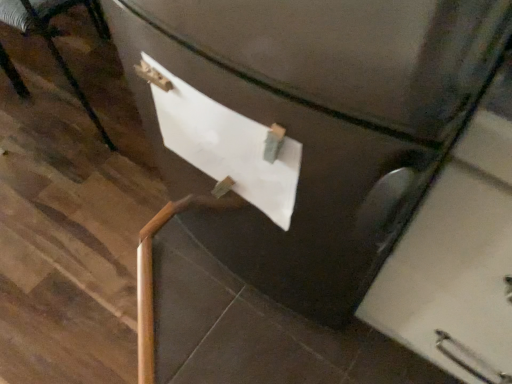
Question: Would you say white matte paper at center is inside or outside brushed metal chair at lower left?

Choices:
 (A) inside
 (B) outside

Answer: (B)

Question: Does point (248, 175) appear closer or farther from the camera than point (28, 31)?

Choices:
 (A) farther
 (B) closer

Answer: (B)

Question: Looking at their shapes, would you say white matte paper at center is wider or thinner than brushed metal chair at lower left?

Choices:
 (A) thin
 (B) wide

Answer: (A)

Question: From the image's perspective, is brushed metal chair at lower left located above or below white matte paper at center?

Choices:
 (A) above
 (B) below

Answer: (A)

Question: Do you think brushed metal chair at lower left is within white matte paper at center, or outside of it?

Choices:
 (A) outside
 (B) inside

Answer: (A)

Question: From their relative heights in the image, would you say brushed metal chair at lower left is taller or shorter than white matte paper at center?

Choices:
 (A) tall
 (B) short

Answer: (A)

Question: Is brushed metal chair at lower left bigger or smaller than white matte paper at center?

Choices:
 (A) small
 (B) big

Answer: (B)